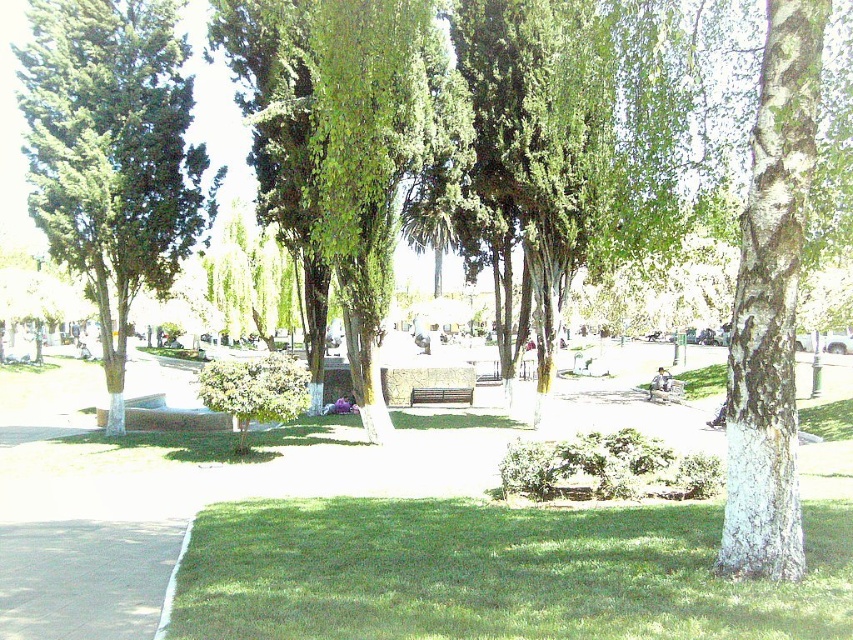
You are standing at the center of the park and want to find the white bark tree at right. Based on the coordinates provided, in which direction should you walk to locate it?

The white bark tree at right is located at coordinates point (770, 304). Since you are at the center, you should walk towards the right side of the park to find it.